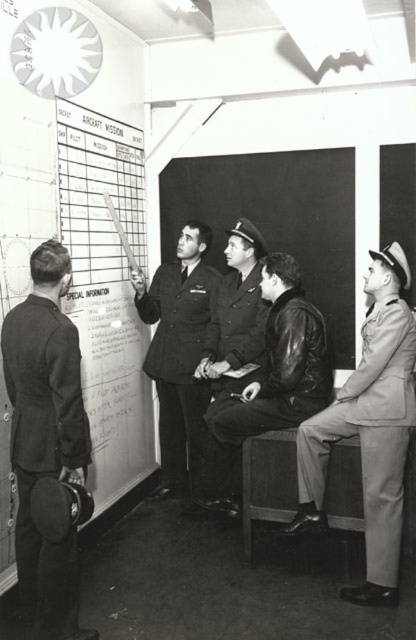
Question: Which point is farther to the camera?

Choices:
 (A) (108, 330)
 (B) (225, 323)
 (C) (74, 548)

Answer: (A)

Question: Does white paperboard at left have a larger size compared to light gray fabric jacket at right?

Choices:
 (A) yes
 (B) no

Answer: (A)

Question: Among these objects, which one is farthest from the camera?

Choices:
 (A) dark suit at left
 (B) white paperboard at left

Answer: (B)

Question: Is dark suit at left in front of light gray fabric jacket at right?

Choices:
 (A) yes
 (B) no

Answer: (A)

Question: Observing the image, what is the correct spatial positioning of light gray fabric jacket at right in reference to uniformed officer at center?

Choices:
 (A) left
 (B) right

Answer: (B)

Question: Which object is the farthest from the dark suit at left?

Choices:
 (A) dark blue leather jacket at center
 (B) white paperboard at left
 (C) leather jacket at center
 (D) uniformed officer at center

Answer: (D)